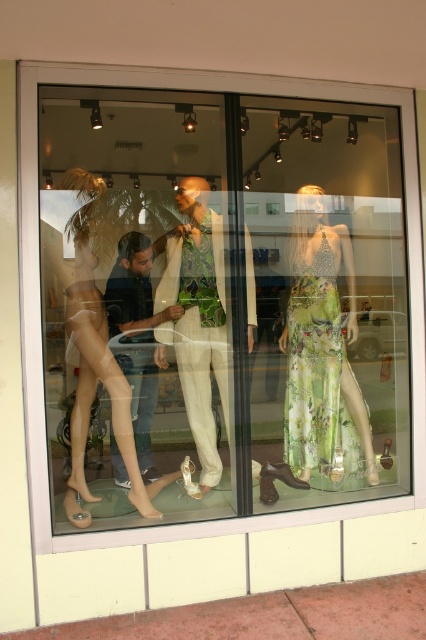
Question: Is transparent plastic mannequin at center above green floral dress at center?

Choices:
 (A) yes
 (B) no

Answer: (A)

Question: Which point appears closest to the camera in this image?

Choices:
 (A) (74, 502)
 (B) (109, 353)

Answer: (B)

Question: Where is white fabric suit at center located in relation to translucent plastic dress at center in the image?

Choices:
 (A) below
 (B) above

Answer: (B)

Question: Among these objects, which one is farthest from the camera?

Choices:
 (A) translucent plastic dress at center
 (B) white fabric suit at center
 (C) green floral dress at center

Answer: (C)

Question: Is white fabric suit at center closer to the viewer compared to translucent plastic dress at center?

Choices:
 (A) yes
 (B) no

Answer: (B)

Question: Which point appears closest to the camera in this image?

Choices:
 (A) (74, 413)
 (B) (201, 266)
 (C) (368, 420)
 (D) (22, 100)

Answer: (D)